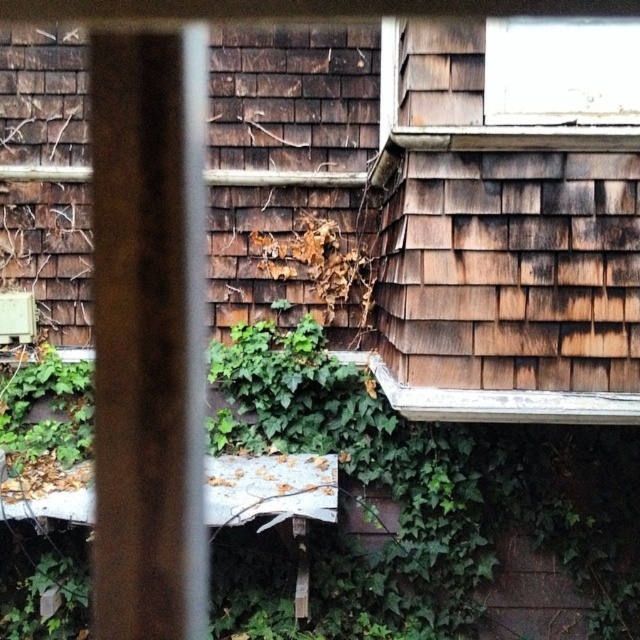
You are standing in front of the house and notice two windows. The white painted wood window at upper right and the transparent glass window at upper center. From your perspective, which window is positioned to the left?

The white painted wood window at upper right is positioned to the left of the transparent glass window at upper center.

You are a painter assessing the house for repairs. You notice the white painted wood window at upper right and the transparent glass window at upper center. Which window should you prioritize if you need to address height differences first?

The white painted wood window at upper right should be prioritized since it is taller than the transparent glass window at upper center.

Based on the scene description, where is the white painted wood window at upper right located in terms of coordinates?

The white painted wood window at upper right is located at coordinates (554, 76).